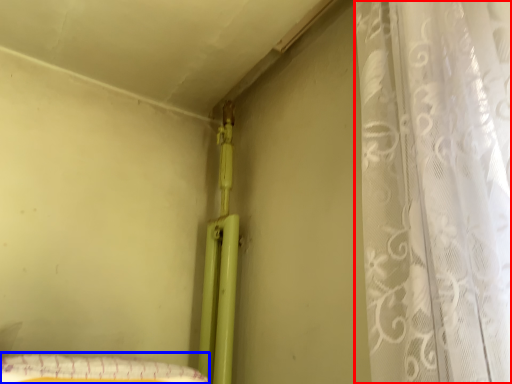
Question: Which of the following is the farthest to the observer, curtain (highlighted by a red box) or sheet (highlighted by a blue box)?

Choices:
 (A) curtain
 (B) sheet

Answer: (B)